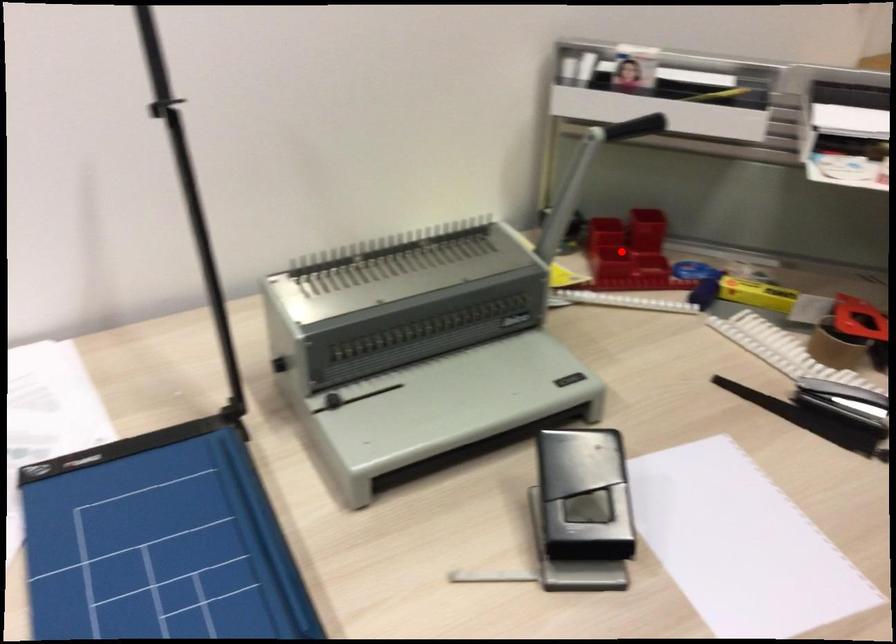
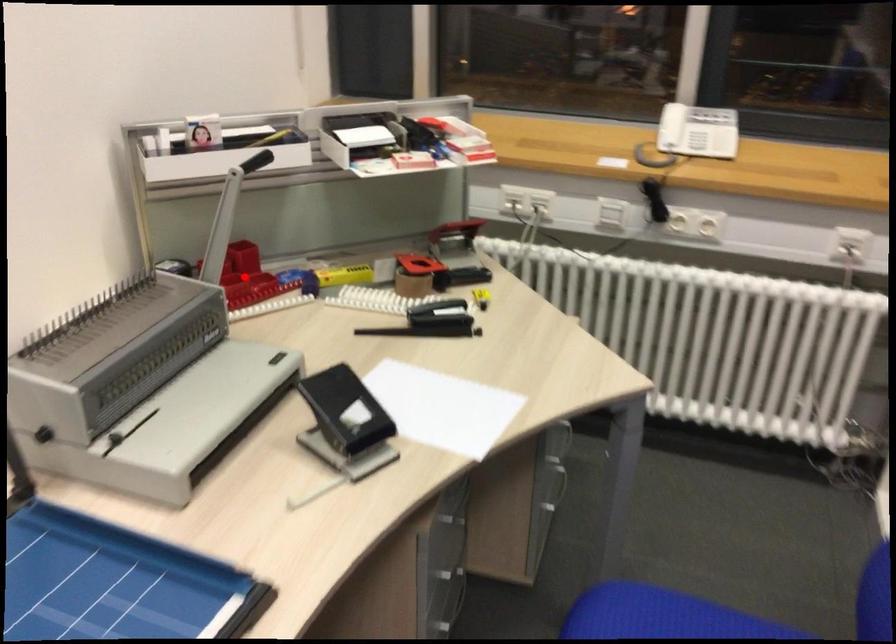
I am providing you with two images of the same scene from different viewpoints. A red point is marked on the first image and another point is marked on the second image. Is the red point in image1 aligned with the point shown in image2?

Yes